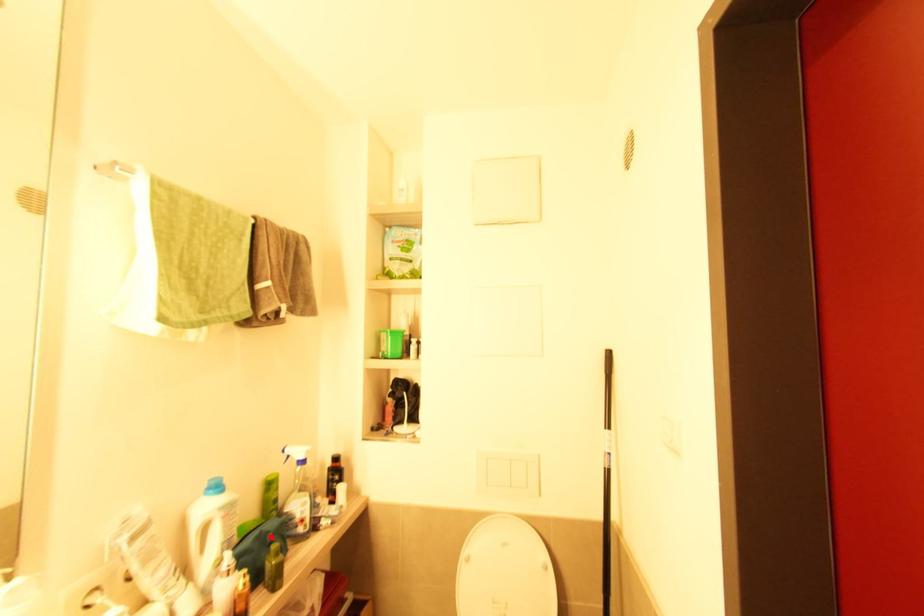
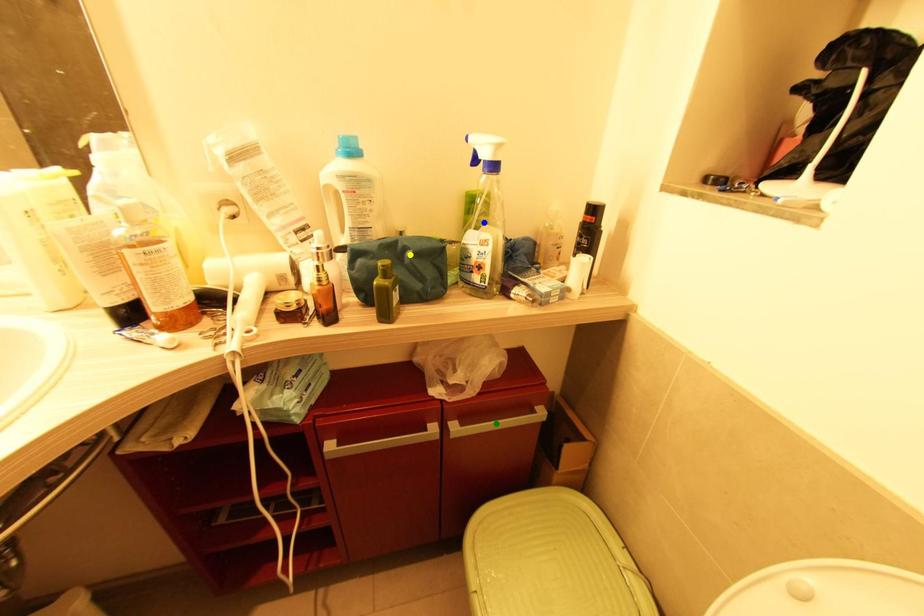
Question: I am providing you with two images of the same scene from different viewpoints. A red point is marked on the first image. You are given multiple points on the second image. Can you choose the point in image 2 that corresponds to the point in image 1?

Choices:
 (A) yellow point
 (B) blue point
 (C) green point

Answer: (A)